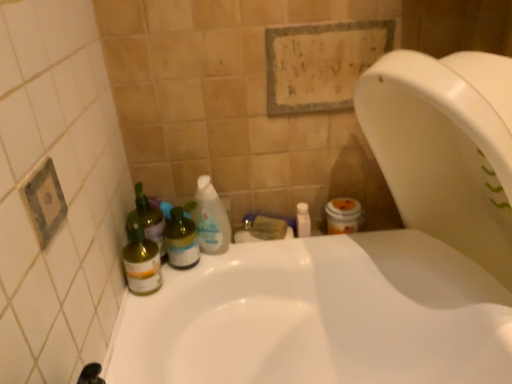
Question: Looking at the image, does white glossy bottle at upper center seem bigger or smaller compared to translucent plastic bottle at left, the second cleaning product in the right-to-left sequence?

Choices:
 (A) big
 (B) small

Answer: (B)

Question: Considering the positions of white glossy bottle at upper center and translucent plastic bottle at left, which is the first cleaning product from left to right, in the image, is white glossy bottle at upper center wider or thinner than translucent plastic bottle at left, which is the first cleaning product from left to right,?

Choices:
 (A) thin
 (B) wide

Answer: (B)

Question: Estimate the real-world distances between objects in this image. Which object is farther from the translucent green bottle at left, positioned as the 2th bottle in right-to-left order?

Choices:
 (A) white glossy bottle at upper center
 (B) green glass bottle at left, positioned as the first bottle in right-to-left order
 (C) translucent plastic bottle at left, the second cleaning product in the right-to-left sequence
 (D) translucent plastic bottle at center, placed as the 2th cleaning product when sorted from left to right

Answer: (A)

Question: Estimate the real-world distances between objects in this image. Which object is closer to the translucent green bottle at left, the first bottle positioned from the left?

Choices:
 (A) green glass bottle at left, positioned as the first bottle in right-to-left order
 (B) translucent plastic bottle at center, which is the first cleaning product in right-to-left order
 (C) translucent plastic bottle at left, which is the first cleaning product from left to right
 (D) white glossy bottle at upper center

Answer: (C)